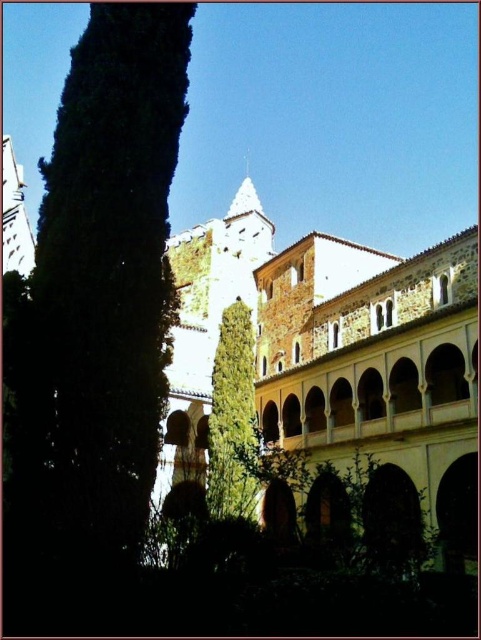
Who is taller, green leafy tree at left or green leafy tree at center?

Standing taller between the two is green leafy tree at left.

Is green leafy tree at left below green leafy tree at center?

Incorrect, green leafy tree at left is not positioned below green leafy tree at center.

Between point (164, 401) and point (229, 344), which one is positioned behind?

The point (229, 344) is more distant.

Locate an element on the screen. green leafy tree at left is located at coordinates 98,292.